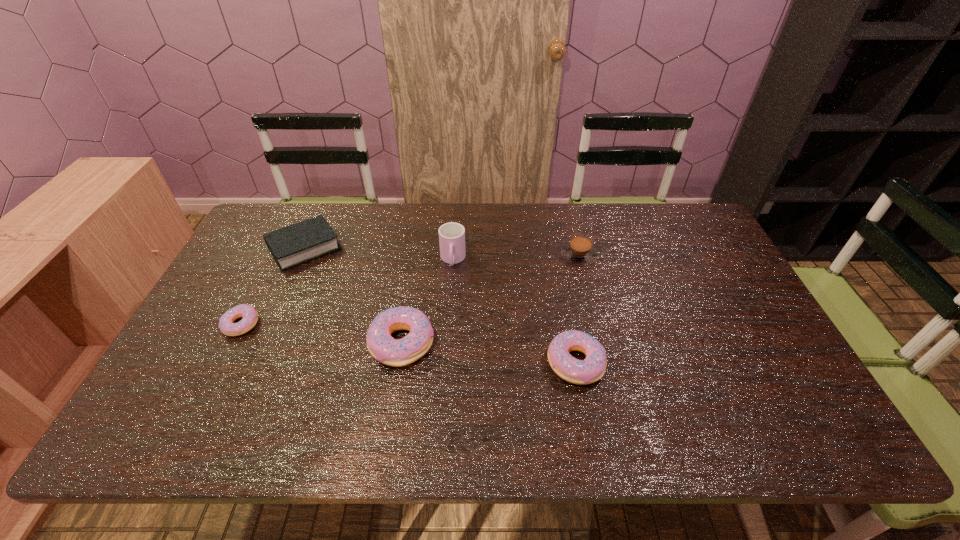
Given the evenly spaced doughnuts in the image, where should an extra doughnut be added on the right to preserve the spacing? Please point to a vacant space. Please provide its 2D coordinates. Your answer should be formatted as a tuple, i.e. [(x, y)], where the tuple contains the x and y coordinates of a point satisfying the conditions above.

[(765, 385)]